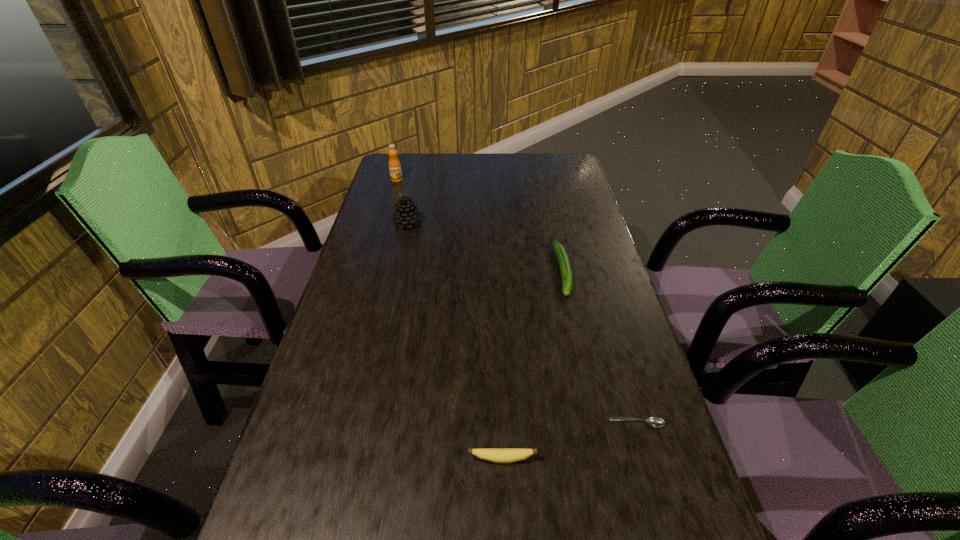
Where is `object present at the far left corner`? Image resolution: width=960 pixels, height=540 pixels. object present at the far left corner is located at coordinates (394, 164).

The height and width of the screenshot is (540, 960). In the image, there is a desktop. In order to click on vacant space at the far edge in this screenshot , I will do `click(484, 174)`.

What are the coordinates of `free space at the left edge of the desktop` in the screenshot? It's located at (280, 486).

Locate an element on the screen. The width and height of the screenshot is (960, 540). vacant region at the right edge of the desktop is located at coordinates (643, 382).

Find the location of a particular element. The width and height of the screenshot is (960, 540). vacant point at the far right corner is located at coordinates (548, 166).

Where is `free space between the pinecone and the third farthest object`? Image resolution: width=960 pixels, height=540 pixels. free space between the pinecone and the third farthest object is located at coordinates (486, 247).

You are a GUI agent. You are given a task and a screenshot of the screen. Output one action in this format:
    pyautogui.click(x=<x>, y=<y>)
    Task: Click on the blank region between the shortest object and the fourth object from right to left
    
    Given the screenshot: What is the action you would take?
    [x=522, y=323]

Find the location of a particular element. This screenshot has height=540, width=960. free space between the third nearest object and the tallest object is located at coordinates (480, 226).

Find the location of a particular element. unoccupied area between the zucchini and the second object from left to right is located at coordinates (486, 247).

Where is `unoccupied position between the nearest object and the tallest object`? unoccupied position between the nearest object and the tallest object is located at coordinates click(x=449, y=320).